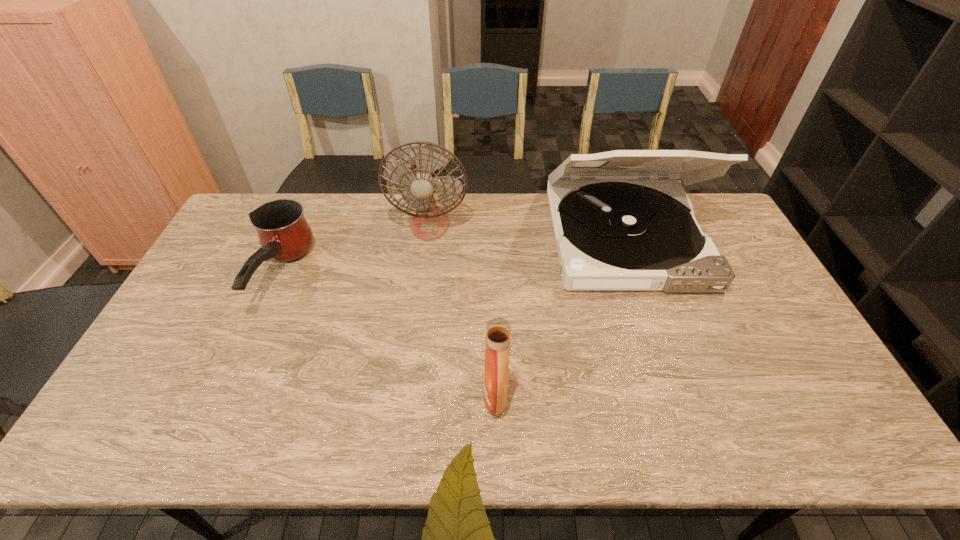
This screenshot has width=960, height=540. I want to click on vacant area that lies between the CD player and the detergent, so click(x=561, y=317).

Where is `free space between the second object from right to left and the CD player`? Image resolution: width=960 pixels, height=540 pixels. free space between the second object from right to left and the CD player is located at coordinates (561, 317).

At what (x,y) coordinates should I click in order to perform the action: click on empty location between the CD player and the third object from right to left. Please return your answer as a coordinate pair (x, y). Looking at the image, I should click on (528, 231).

Image resolution: width=960 pixels, height=540 pixels. Identify the location of the closest object to the second object from right to left. (615, 229).

Select which object is the third closest to the second object from left to right. Please provide its 2D coordinates. Your answer should be formatted as a tuple, i.e. [(x, y)], where the tuple contains the x and y coordinates of a point satisfying the conditions above.

[(498, 330)]

Locate an element on the screen. free spot that satisfies the following two spatial constraints: 1. on the control panel of the rightmost object; 2. on the front-facing side of the nearest object is located at coordinates (680, 396).